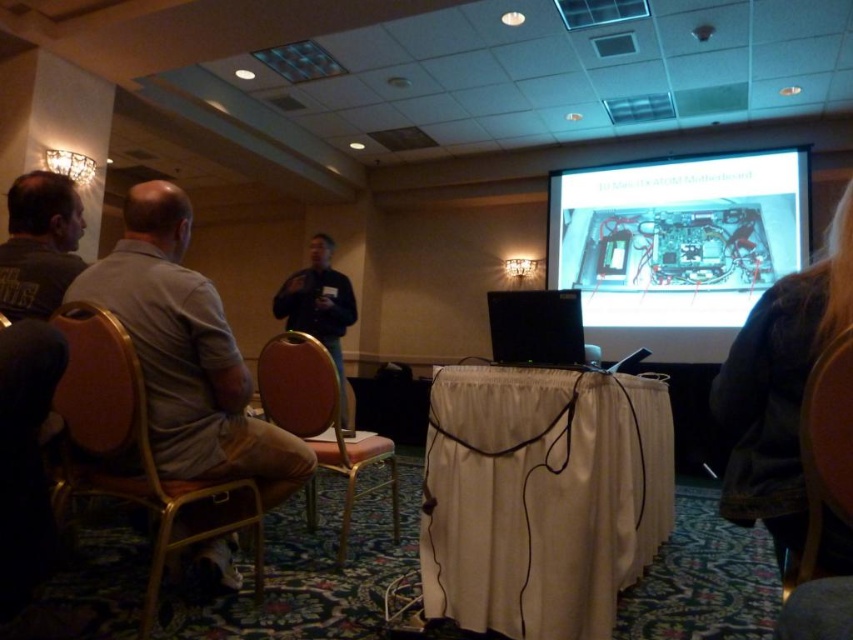
Is white glossy projection screen at upper center wider than dark gray t-shirt at left?

Yes.

You are a GUI agent. You are given a task and a screenshot of the screen. Output one action in this format:
    pyautogui.click(x=<x>, y=<y>)
    Task: Click on the white glossy projection screen at upper center
    The height and width of the screenshot is (640, 853).
    Given the screenshot: What is the action you would take?
    pyautogui.click(x=676, y=244)

Find the location of `white glossy projection screen at upper center`. white glossy projection screen at upper center is located at coordinates (676, 244).

Is matte gold chair at center wider than dark gray t-shirt at left?

Correct, the width of matte gold chair at center exceeds that of dark gray t-shirt at left.

Who is more forward, (283, 371) or (44, 314)?

Positioned in front is point (44, 314).

Where is `matte gold chair at center`? The image size is (853, 640). matte gold chair at center is located at coordinates (318, 417).

Identify the location of matte gold chair at center. The image size is (853, 640). (318, 417).

From the picture: Does white cloth-covered table at center appear on the left side of brown fuzzy jacket at lower right?

Indeed, white cloth-covered table at center is positioned on the left side of brown fuzzy jacket at lower right.

The image size is (853, 640). Describe the element at coordinates (541, 497) in the screenshot. I see `white cloth-covered table at center` at that location.

Locate an element on the screen. Image resolution: width=853 pixels, height=640 pixels. white cloth-covered table at center is located at coordinates (541, 497).